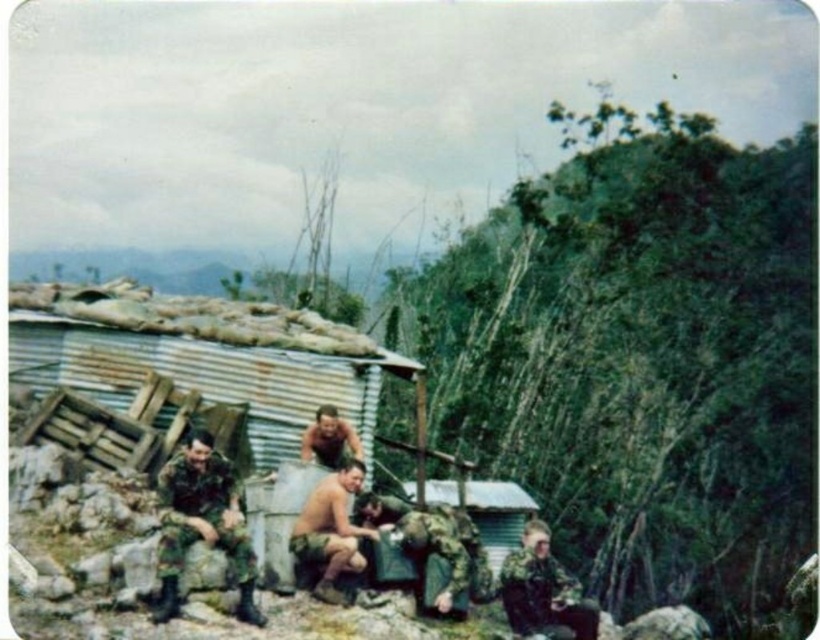
Question: Can you confirm if camouflage fabric uniform at lower left is bigger than brown camouflage shorts at center?

Choices:
 (A) yes
 (B) no

Answer: (A)

Question: Is brown camouflage shorts at center thinner than brown camouflage uniform at center?

Choices:
 (A) no
 (B) yes

Answer: (A)

Question: Is camouflage fabric uniform at lower left further to camera compared to camouflage fabric shirt at center?

Choices:
 (A) no
 (B) yes

Answer: (A)

Question: Which of the following is the farthest from the observer?

Choices:
 (A) camouflage fabric uniform at lower right
 (B) camouflage fabric uniform at lower left
 (C) brown camouflage shorts at center
 (D) brown camouflage uniform at center

Answer: (D)

Question: Estimate the real-world distances between objects in this image. Which object is closer to the brown camouflage uniform at center?

Choices:
 (A) brown camouflage shorts at center
 (B) camouflage fabric uniform at lower right
 (C) camouflage fabric uniform at lower left
 (D) camouflage fabric shirt at center

Answer: (D)

Question: Which object is positioned farthest from the camouflage fabric uniform at lower left?

Choices:
 (A) camouflage fabric uniform at lower right
 (B) brown camouflage uniform at center
 (C) camouflage fabric shirt at center
 (D) brown camouflage shorts at center

Answer: (A)